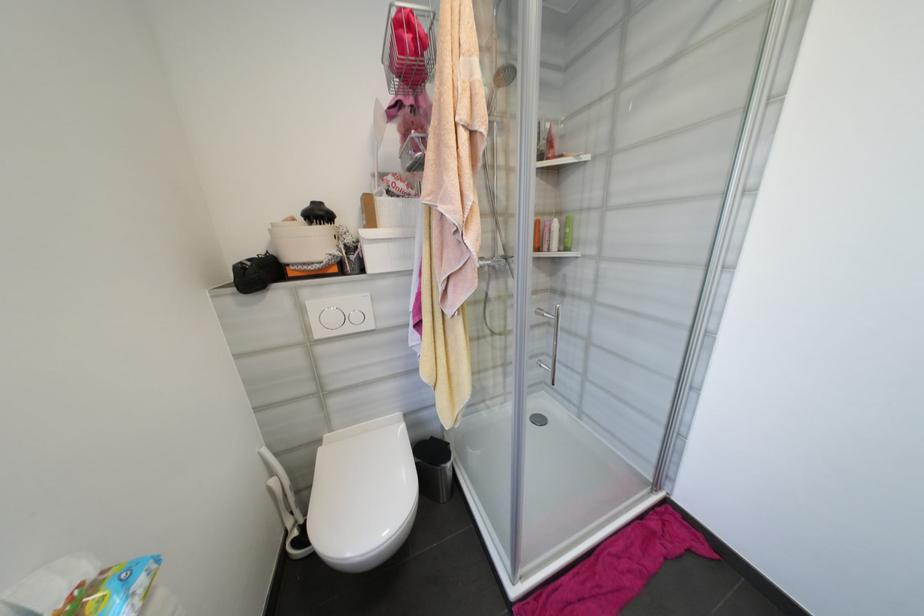
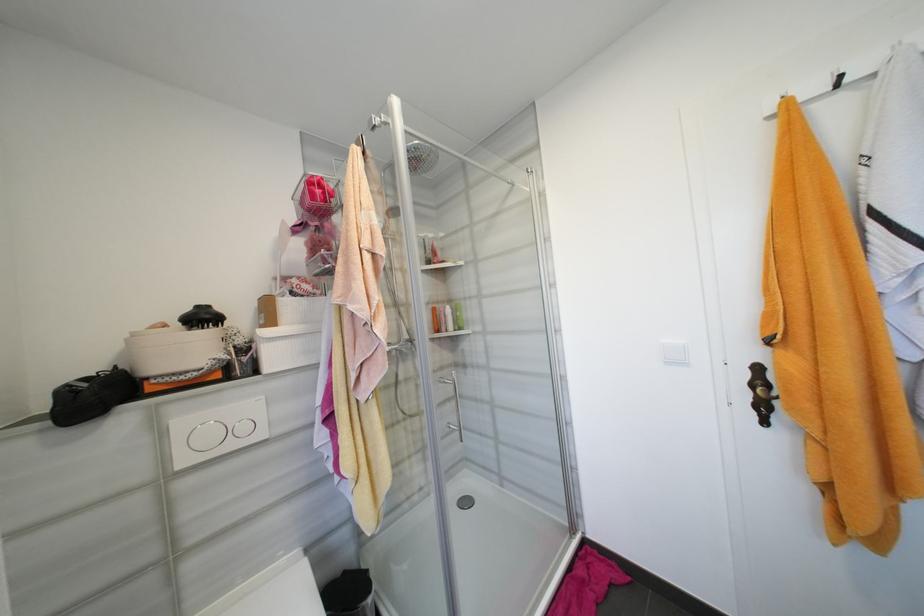
Locate, in the second image, the point that corresponds to point 361,318 in the first image.

(249, 429)